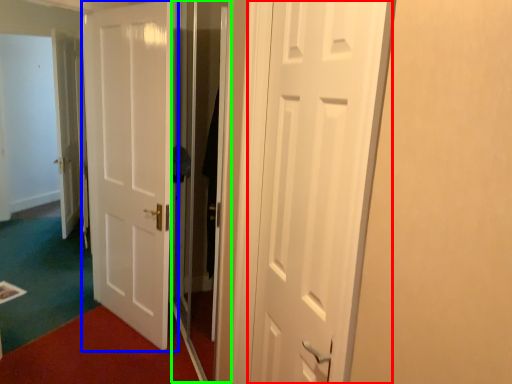
Question: Which object is positioned farthest from door (highlighted by a red box)? Select from door (highlighted by a blue box) and screen door (highlighted by a green box).

Choices:
 (A) door
 (B) screen door

Answer: (A)